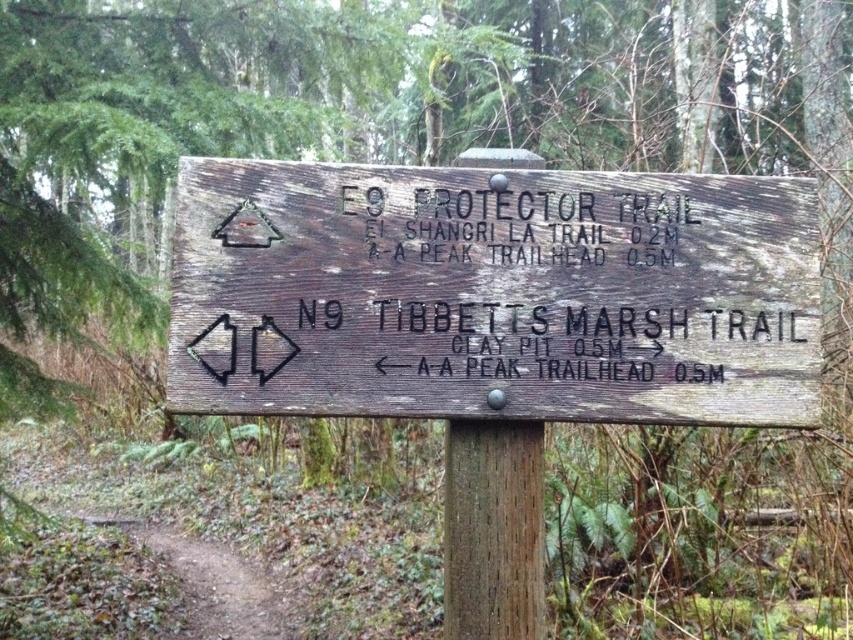
You are a hiker trying to decide which trail to take. You see the weathered brown wood at center and the brown dirt path at lower left. Which object is narrower?

The weathered brown wood at center is narrower than the brown dirt path at lower left.

You are a hiker trying to decide which trail to take next. You see the weathered wood sign at center and the weathered brown wood at center. Which object would you focus on for trail distance information?

The weathered wood sign at center is bigger than weathered brown wood at center, so you should focus on the weathered wood sign at center for trail distance information since it is larger and likely contains the necessary details.

You are a hiker who wants to check the distance to the nearest trailhead. You see a weathered wood sign at center and a weathered brown wood at center. Which object should you look at to find the distance information?

The weathered wood sign at center is positioned over weathered brown wood at center. You should look at the weathered wood sign at center to find the distance information because it is the sign providing trail details, while the weathered brown wood at center is likely part of the signpost structure.